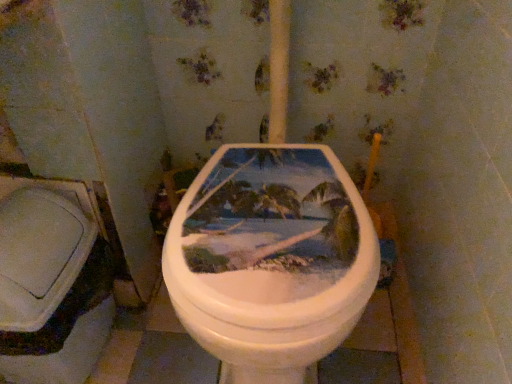
Describe the element at coordinates (41, 248) in the screenshot. The image size is (512, 384). I see `white plastic lid at lower left` at that location.

I want to click on white plastic lid at lower left, so click(x=41, y=248).

This screenshot has height=384, width=512. I want to click on white plastic lid at lower left, so click(41, 248).